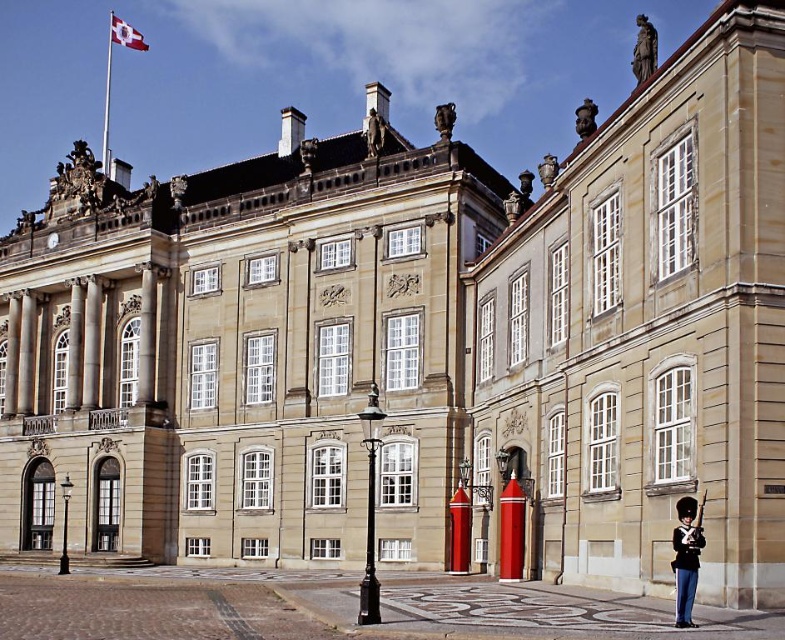
Can you confirm if matte stone building at right is wider than polished bronze statue at upper right?

No.

Does matte stone building at right appear under polished bronze statue at upper right?

Yes, matte stone building at right is below polished bronze statue at upper right.

Find the location of a particular element. The width and height of the screenshot is (785, 640). matte stone building at right is located at coordinates pyautogui.click(x=647, y=328).

Describe the element at coordinates (644, 49) in the screenshot. I see `polished bronze statue at upper right` at that location.

Who is more forward, (x=652, y=36) or (x=130, y=45)?

Point (x=652, y=36) is in front.

Locate an element on the screen. polished bronze statue at upper right is located at coordinates (644, 49).

Does smooth stone building at center appear over white fabric flag at upper left?

Incorrect, smooth stone building at center is not positioned above white fabric flag at upper left.

Who is taller, smooth stone building at center or white fabric flag at upper left?

With more height is smooth stone building at center.

Is point (426, 488) positioned behind point (111, 42)?

That is False.

Image resolution: width=785 pixels, height=640 pixels. I want to click on smooth stone building at center, so click(x=243, y=348).